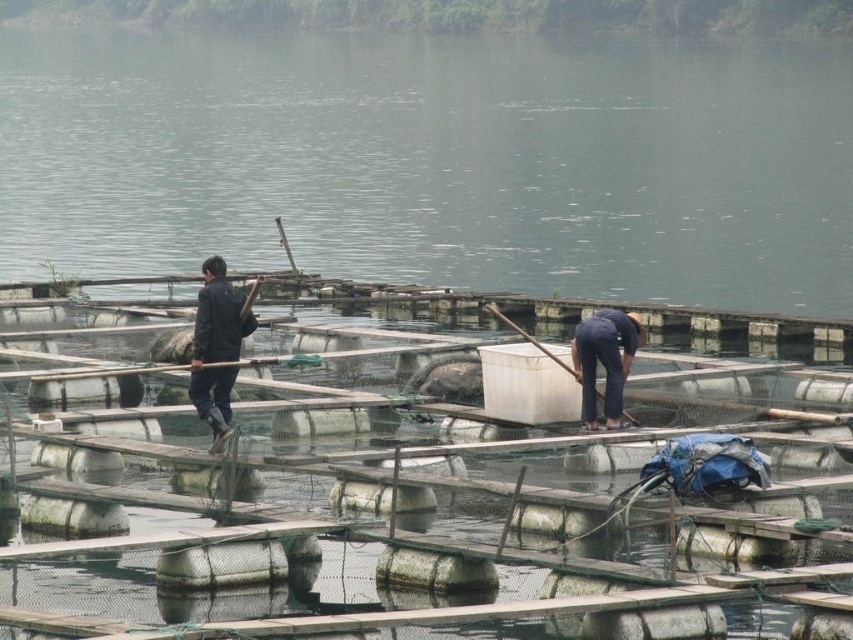
Measure the distance from dark blue jacket at upper left to dark blue uniform at lower center.

dark blue jacket at upper left and dark blue uniform at lower center are 4.89 meters apart from each other.

Between dark blue jacket at upper left and dark blue uniform at lower center, which one has less height?

dark blue jacket at upper left

What do you see at coordinates (218, 348) in the screenshot? I see `dark blue jacket at upper left` at bounding box center [218, 348].

I want to click on dark blue jacket at upper left, so click(218, 348).

Can you confirm if clear water at center is thinner than dark blue jacket at upper left?

Incorrect, clear water at center's width is not less than dark blue jacket at upper left's.

Between clear water at center and dark blue jacket at upper left, which one appears on the right side from the viewer's perspective?

clear water at center

Measure the distance between clear water at center and camera.

192.37 feet

This screenshot has height=640, width=853. I want to click on clear water at center, so click(x=436, y=161).

Is point (4, 253) in front of point (598, 323)?

No, (4, 253) is further to viewer.

Is clear water at center further to the viewer compared to dark blue uniform at lower center?

That is True.

Does point (393, 36) lie behind point (614, 384)?

Yes, point (393, 36) is behind point (614, 384).

What are the coordinates of `clear water at center` in the screenshot? It's located at (436, 161).